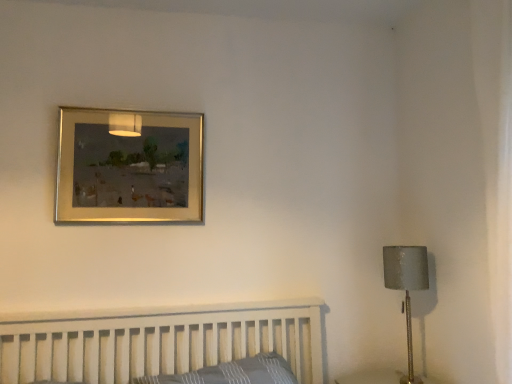
Question: Based on their positions, is gray plaid pillow at lower center located to the left or right of matte gray lampshade at right?

Choices:
 (A) right
 (B) left

Answer: (B)

Question: Considering the positions of gray plaid pillow at lower center and matte gray lampshade at right in the image, is gray plaid pillow at lower center bigger or smaller than matte gray lampshade at right?

Choices:
 (A) big
 (B) small

Answer: (A)

Question: Which of these objects is positioned closest to the gray plaid pillow at lower center?

Choices:
 (A) matte gray lampshade at right
 (B) gold metallic picture frame at upper center

Answer: (A)

Question: Estimate the real-world distances between objects in this image. Which object is closer to the gold metallic picture frame at upper center?

Choices:
 (A) matte gray lampshade at right
 (B) gray plaid pillow at lower center

Answer: (B)